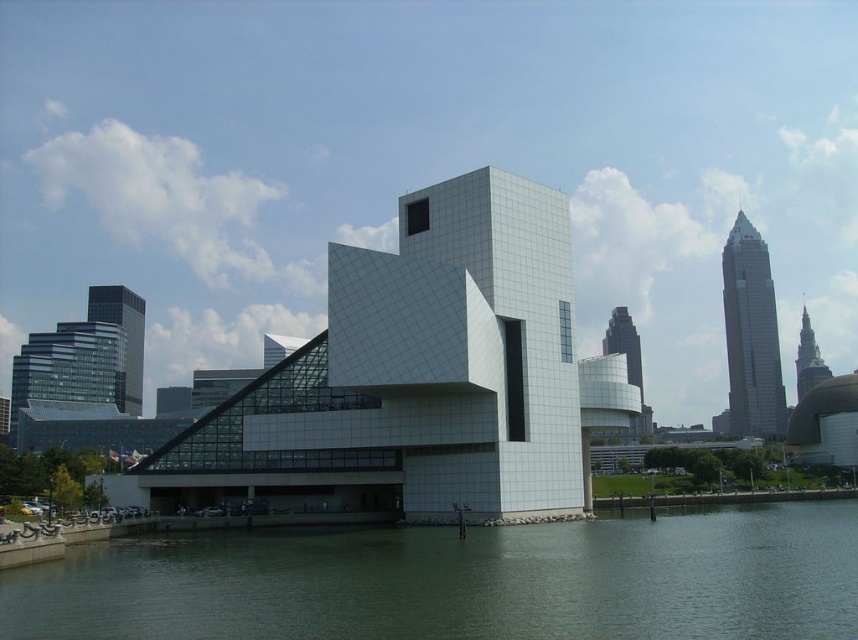
You are an architect evaluating the space in the image. Which object takes up more area in the scene between the green smooth water at lower center and the glass skyscraper at upper right?

The glass skyscraper at upper right occupies more space in the scene than the green smooth water at lower center.

You are a drone operator who needs to fly your drone from the green smooth water at lower center to the glass skyscraper at upper right. What is the minimum distance you need to cover?

The minimum distance you need to cover is 222.65 meters between the green smooth water at lower center and the glass skyscraper at upper right.